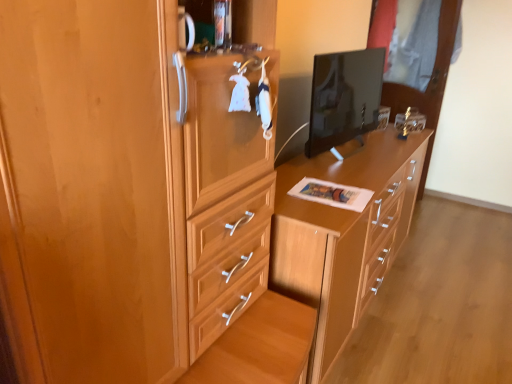
This screenshot has width=512, height=384. What do you see at coordinates (428, 83) in the screenshot?
I see `transparent glass door at upper right` at bounding box center [428, 83].

Find the location of a particular element. The image size is (512, 384). matte black monitor at center is located at coordinates (344, 97).

I want to click on transparent glass door at upper right, so click(428, 83).

Is transparent glass door at upper right oriented towards matte wood cabinet at center?

Yes, transparent glass door at upper right faces towards matte wood cabinet at center.

From a real-world perspective, is transparent glass door at upper right positioned above or below matte wood cabinet at center?

In terms of real-world spatial position, transparent glass door at upper right is above matte wood cabinet at center.

From the image's perspective, is transparent glass door at upper right on matte wood cabinet at center?

Yes, from the image's perspective, transparent glass door at upper right is above matte wood cabinet at center.

Is there a large distance between transparent glass door at upper right and matte wood cabinet at center?

Yes.

Does point (231, 147) lie behind point (320, 152)?

No, (231, 147) is in front of (320, 152).

Considering the positions of objects matte wood cabinet at center and matte black monitor at center in the image provided, who is more to the left, matte wood cabinet at center or matte black monitor at center?

Positioned to the left is matte wood cabinet at center.

Is matte wood cabinet at center aimed at matte black monitor at center?

No, matte wood cabinet at center is not oriented towards matte black monitor at center.

In the image, is matte wood cabinet at center positioned in front of or behind matte black monitor at center?

In the image, matte wood cabinet at center appears in front of matte black monitor at center.

Does matte black monitor at center touch transparent glass door at upper right?

No.

Which object is positioned more to the left, matte black monitor at center or transparent glass door at upper right?

From the viewer's perspective, matte black monitor at center appears more on the left side.

Is matte black monitor at center aimed at transparent glass door at upper right?

No, matte black monitor at center is not oriented towards transparent glass door at upper right.

From a real-world perspective, who is located higher, wooden chest of drawers at center or transparent glass door at upper right?

transparent glass door at upper right is physically above.

Where is `glass door above the wooden chest of drawers at center (from the image's perspective)`? glass door above the wooden chest of drawers at center (from the image's perspective) is located at coordinates (428, 83).

Considering the relative sizes of wooden chest of drawers at center and transparent glass door at upper right in the image provided, is wooden chest of drawers at center wider than transparent glass door at upper right?

Yes, wooden chest of drawers at center is wider than transparent glass door at upper right.

Considering the points (338, 57) and (337, 269), which point is behind, point (338, 57) or point (337, 269)?

The point (338, 57) is behind.

From the image's perspective, is matte black monitor at center positioned above or below wooden chest of drawers at center?

matte black monitor at center is situated higher than wooden chest of drawers at center in the image.

Is matte black monitor at center not inside wooden chest of drawers at center?

Yes.

Relative to wooden chest of drawers at center, is matte black monitor at center in front or behind?

matte black monitor at center is behind wooden chest of drawers at center.

Is transparent glass door at upper right not within matte black monitor at center?

Yes, transparent glass door at upper right is not within matte black monitor at center.

From a real-world perspective, is transparent glass door at upper right physically above matte black monitor at center?

No.

Is transparent glass door at upper right directly adjacent to matte black monitor at center?

transparent glass door at upper right and matte black monitor at center are not in contact.

Does transparent glass door at upper right turn towards matte black monitor at center?

Yes, transparent glass door at upper right is oriented towards matte black monitor at center.

From the image's perspective, is matte wood cabinet at center beneath transparent glass door at upper right?

Correct, matte wood cabinet at center appears lower than transparent glass door at upper right in the image.

Is matte wood cabinet at center bigger or smaller than transparent glass door at upper right?

Clearly, matte wood cabinet at center is larger in size than transparent glass door at upper right.

Between matte wood cabinet at center and transparent glass door at upper right, which one has smaller width?

Thinner between the two is transparent glass door at upper right.

Would you consider matte wood cabinet at center to be distant from transparent glass door at upper right?

Yes.

In order to click on glass door located on the right of matte wood cabinet at center in this screenshot , I will do `click(428, 83)`.

Locate an element on the screen. computer monitor behind the matte wood cabinet at center is located at coordinates (344, 97).

When comparing their distances from wooden chest of drawers at center, does transparent glass door at upper right or matte black monitor at center seem closer?

matte black monitor at center is closer to wooden chest of drawers at center.

When comparing their distances from transparent glass door at upper right, does wooden chest of drawers at center or matte black monitor at center seem closer?

Among the two, matte black monitor at center is located nearer to transparent glass door at upper right.

Looking at the image, which one is located further to matte black monitor at center, transparent glass door at upper right or wooden chest of drawers at center?

Among the two, transparent glass door at upper right is located further to matte black monitor at center.

Considering their positions, is matte wood cabinet at center positioned closer to transparent glass door at upper right than matte black monitor at center?

The object closer to transparent glass door at upper right is matte black monitor at center.

When comparing their distances from matte black monitor at center, does matte wood cabinet at center or transparent glass door at upper right seem closer?

The object closer to matte black monitor at center is matte wood cabinet at center.

Considering their positions, is matte black monitor at center positioned closer to wooden chest of drawers at center than matte wood cabinet at center?

The object closer to wooden chest of drawers at center is matte black monitor at center.

Based on their spatial positions, is wooden chest of drawers at center or transparent glass door at upper right further from matte black monitor at center?

transparent glass door at upper right is positioned further to the anchor matte black monitor at center.

Looking at the image, which one is located closer to matte black monitor at center, transparent glass door at upper right or matte wood cabinet at center?

matte wood cabinet at center is positioned closer to the anchor matte black monitor at center.

Where is `chest of drawers between matte wood cabinet at center and matte black monitor at center from front to back`? This screenshot has height=384, width=512. chest of drawers between matte wood cabinet at center and matte black monitor at center from front to back is located at coordinates (344, 234).

Image resolution: width=512 pixels, height=384 pixels. I want to click on the chest of drawers positioned between matte wood cabinet at center and transparent glass door at upper right from near to far, so click(344, 234).

Image resolution: width=512 pixels, height=384 pixels. In order to click on computer monitor between matte wood cabinet at center and transparent glass door at upper right along the z-axis in this screenshot , I will do `click(344, 97)`.

Locate an element on the screen. This screenshot has height=384, width=512. computer monitor between wooden chest of drawers at center and transparent glass door at upper right along the z-axis is located at coordinates (344, 97).